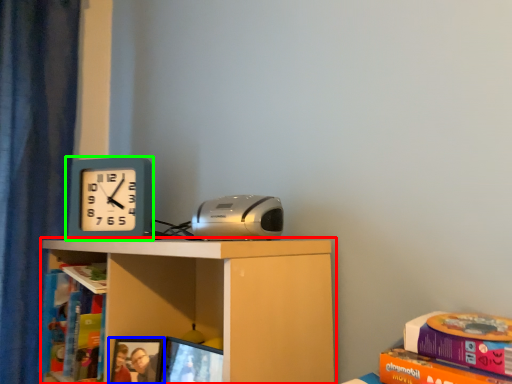
Question: Considering the real-world distances, which object is farthest from shelf (highlighted by a red box)? picture frame (highlighted by a blue box) or wall clock (highlighted by a green box)?

Choices:
 (A) picture frame
 (B) wall clock

Answer: (B)